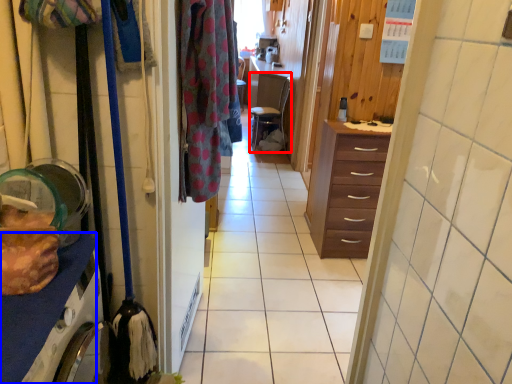
Question: Which object is further to the camera taking this photo, chair (highlighted by a red box) or cabinetry (highlighted by a blue box)?

Choices:
 (A) chair
 (B) cabinetry

Answer: (A)